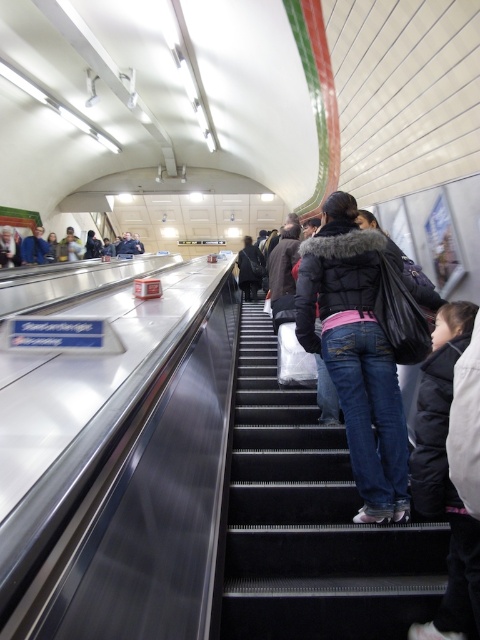
You are standing at the entrance of the subway station and see the black rubber stairs at center and the dark blue jacket at center. Which object is closer to you?

The black rubber stairs at center is closer to you because it is in front of the dark blue jacket at center.

You are standing at the entrance of the subway station and need to reach the platform. The black rubber stairs at center is located at point (311, 522). Can you determine the direction you should walk to reach the black rubber stairs at center from your current position?

The black rubber stairs at center is located at point (311, 522), so you should walk towards that coordinate to reach it.